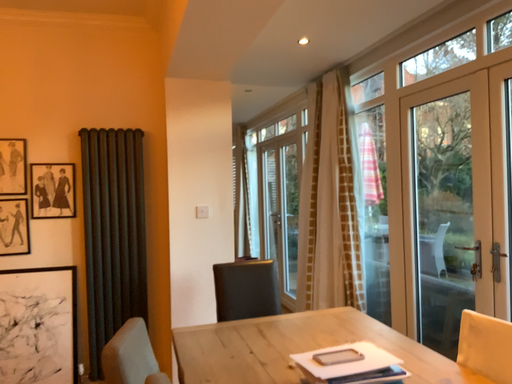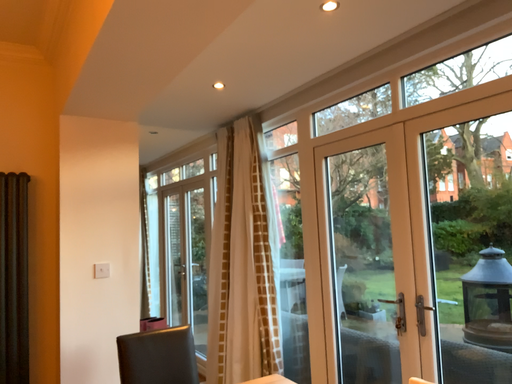
Question: Which way did the camera rotate in the video?

Choices:
 (A) rotated right
 (B) rotated left

Answer: (A)